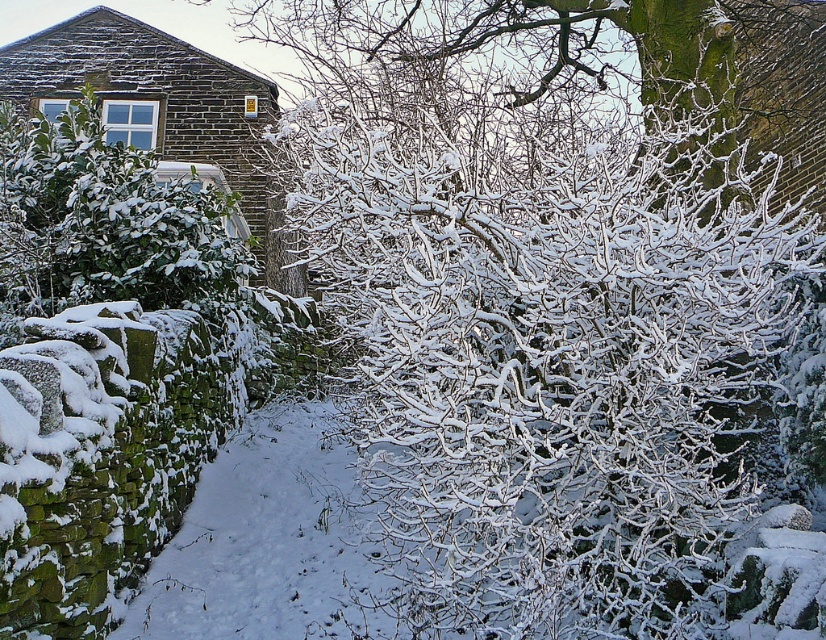
Question: Can you confirm if green leafy bush at upper left is wider than snow-covered branches at upper center?

Choices:
 (A) no
 (B) yes

Answer: (B)

Question: Does green leafy bush at upper left appear under snow-covered branches at upper center?

Choices:
 (A) yes
 (B) no

Answer: (A)

Question: Can you confirm if green leafy bush at upper left is bigger than snow-covered branches at upper center?

Choices:
 (A) yes
 (B) no

Answer: (A)

Question: Which point appears farthest from the camera in this image?

Choices:
 (A) (757, 92)
 (B) (153, 204)

Answer: (A)

Question: Which point is closer to the camera?

Choices:
 (A) (230, 275)
 (B) (796, 51)

Answer: (A)